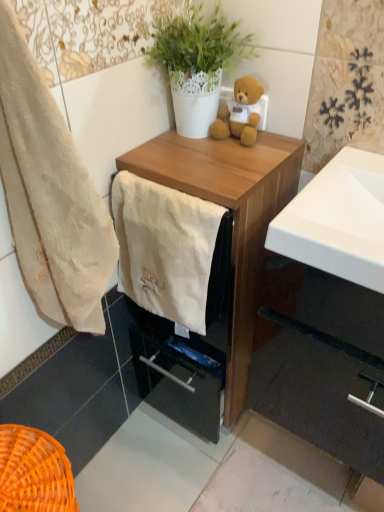
The width and height of the screenshot is (384, 512). Describe the element at coordinates (165, 248) in the screenshot. I see `white soft towel at center, which is the 2th towel/napkin from left to right` at that location.

In order to click on white soft towel at center, the first towel/napkin in the right-to-left sequence in this screenshot , I will do `click(165, 248)`.

You are a GUI agent. You are given a task and a screenshot of the screen. Output one action in this format:
    pyautogui.click(x=<x>, y=<y>)
    Task: Click on the white textured pot at upper center
    This screenshot has width=384, height=512.
    Given the screenshot: What is the action you would take?
    pyautogui.click(x=197, y=63)

Find the location of a particular element. The height and width of the screenshot is (512, 384). soft plush teddy bear at upper center is located at coordinates (240, 113).

What do you see at coordinates (321, 362) in the screenshot? I see `matte wood cabinet at lower right` at bounding box center [321, 362].

The width and height of the screenshot is (384, 512). What are the coordinates of `white glossy sink at center right` in the screenshot? It's located at (338, 220).

This screenshot has height=512, width=384. I want to click on white soft towel at center, which is the 2th towel/napkin from left to right, so click(165, 248).

Which object is further away from the camera, beige cotton towel at left, which appears as the 1th towel/napkin when viewed from the left, or white soft towel at center, the first towel/napkin in the right-to-left sequence?

white soft towel at center, the first towel/napkin in the right-to-left sequence, is further away from the camera.

In terms of size, does beige cotton towel at left, which is counted as the 2th towel/napkin, starting from the right, appear bigger or smaller than white soft towel at center, which is the 2th towel/napkin from left to right?

In the image, beige cotton towel at left, which is counted as the 2th towel/napkin, starting from the right, appears to be larger than white soft towel at center, which is the 2th towel/napkin from left to right.

Image resolution: width=384 pixels, height=512 pixels. What are the coordinates of `towel/napkin below the beige cotton towel at left, which is counted as the 2th towel/napkin, starting from the right (from the image's perspective)` in the screenshot? It's located at (165, 248).

From a real-world perspective, between beige cotton towel at left, which appears as the 1th towel/napkin when viewed from the left, and white soft towel at center, the first towel/napkin in the right-to-left sequence, who is vertically higher?

In real-world perspective, beige cotton towel at left, which appears as the 1th towel/napkin when viewed from the left, is above.

From the image's perspective, is white soft towel at center, the first towel/napkin in the right-to-left sequence, below beige cotton towel at left, which appears as the 1th towel/napkin when viewed from the left?

Yes.

Is white soft towel at center, which is the 2th towel/napkin from left to right, at the right side of beige cotton towel at left, which is counted as the 2th towel/napkin, starting from the right?

Yes.

Would you say white soft towel at center, the first towel/napkin in the right-to-left sequence, is a long distance from beige cotton towel at left, which is counted as the 2th towel/napkin, starting from the right?

They are positioned close to each other.

Does white soft towel at center, which is the 2th towel/napkin from left to right, have a greater width compared to beige cotton towel at left, which appears as the 1th towel/napkin when viewed from the left?

No, white soft towel at center, which is the 2th towel/napkin from left to right, is not wider than beige cotton towel at left, which appears as the 1th towel/napkin when viewed from the left.

Is white soft towel at center, which is the 2th towel/napkin from left to right, to the left of soft plush teddy bear at upper center from the viewer's perspective?

Yes.

From the image's perspective, is white soft towel at center, which is the 2th towel/napkin from left to right, positioned above or below soft plush teddy bear at upper center?

white soft towel at center, which is the 2th towel/napkin from left to right, is below soft plush teddy bear at upper center.

Which is correct: white soft towel at center, which is the 2th towel/napkin from left to right, is inside soft plush teddy bear at upper center, or outside of it?

white soft towel at center, which is the 2th towel/napkin from left to right, is outside soft plush teddy bear at upper center.

Considering the sizes of objects white soft towel at center, the first towel/napkin in the right-to-left sequence, and soft plush teddy bear at upper center in the image provided, who is smaller, white soft towel at center, the first towel/napkin in the right-to-left sequence, or soft plush teddy bear at upper center?

soft plush teddy bear at upper center.

How different are the orientations of matte wood cabinet at lower right and beige cotton towel at left, which appears as the 1th towel/napkin when viewed from the left, in degrees?

The angular difference between matte wood cabinet at lower right and beige cotton towel at left, which appears as the 1th towel/napkin when viewed from the left, is 92.1 degrees.

Looking at this image, does matte wood cabinet at lower right have a lesser width compared to beige cotton towel at left, which appears as the 1th towel/napkin when viewed from the left?

No.

Does matte wood cabinet at lower right have a larger size compared to beige cotton towel at left, which appears as the 1th towel/napkin when viewed from the left?

Yes.

In the image, is wooden chest of drawers at center positioned in front of or behind matte wood cabinet at lower right?

Visually, wooden chest of drawers at center is located in front of matte wood cabinet at lower right.

Is wooden chest of drawers at center oriented away from matte wood cabinet at lower right?

wooden chest of drawers at center does not have its back to matte wood cabinet at lower right.

From the image's perspective, does wooden chest of drawers at center appear higher than matte wood cabinet at lower right?

Indeed, from the image's perspective, wooden chest of drawers at center is shown above matte wood cabinet at lower right.

Does point (232, 179) appear closer or farther from the camera than point (362, 340)?

Point (232, 179) appears to be closer to the viewer than point (362, 340).

In the image, is white glossy sink at center right on the left side or the right side of wooden chest of drawers at center?

Based on their positions, white glossy sink at center right is located to the right of wooden chest of drawers at center.

Identify the location of chest of drawers below the white glossy sink at center right (from the image's perspective). (233, 215).

Is white glossy sink at center right aimed at wooden chest of drawers at center?

No.

From the image's perspective, is wooden chest of drawers at center positioned above or below soft plush teddy bear at upper center?

Based on their image positions, wooden chest of drawers at center is located beneath soft plush teddy bear at upper center.

Could you tell me if wooden chest of drawers at center is turned towards soft plush teddy bear at upper center?

No, wooden chest of drawers at center is not aimed at soft plush teddy bear at upper center.

Between wooden chest of drawers at center and soft plush teddy bear at upper center, which one has smaller size?

With smaller size is soft plush teddy bear at upper center.

At what (x,y) coordinates should I click in order to perform the action: click on towel/napkin above the white soft towel at center, the first towel/napkin in the right-to-left sequence (from the image's perspective). Please return your answer as a coordinate pair (x, y). The width and height of the screenshot is (384, 512). Looking at the image, I should click on (50, 194).

The height and width of the screenshot is (512, 384). Identify the location of towel/napkin located behind the beige cotton towel at left, which appears as the 1th towel/napkin when viewed from the left. (165, 248).

Based on their spatial positions, is beige cotton towel at left, which appears as the 1th towel/napkin when viewed from the left, or white glossy sink at center right closer to soft plush teddy bear at upper center?

white glossy sink at center right lies closer to soft plush teddy bear at upper center than the other object.

Looking at the image, which one is located further to white soft towel at center, which is the 2th towel/napkin from left to right, white textured pot at upper center or wooden chest of drawers at center?

white textured pot at upper center is positioned further to the anchor white soft towel at center, which is the 2th towel/napkin from left to right.

Based on the photo, looking at the image, which one is located further to soft plush teddy bear at upper center, matte wood cabinet at lower right or wooden chest of drawers at center?

matte wood cabinet at lower right is further to soft plush teddy bear at upper center.

Estimate the real-world distances between objects in this image. Which object is closer to beige cotton towel at left, which is counted as the 2th towel/napkin, starting from the right, wooden chest of drawers at center or matte wood cabinet at lower right?

Based on the image, wooden chest of drawers at center appears to be nearer to beige cotton towel at left, which is counted as the 2th towel/napkin, starting from the right.

From the image, which object appears to be nearer to matte wood cabinet at lower right, wooden chest of drawers at center or white textured pot at upper center?

wooden chest of drawers at center is closer to matte wood cabinet at lower right.

Based on their spatial positions, is white glossy sink at center right or wooden chest of drawers at center closer to matte wood cabinet at lower right?

wooden chest of drawers at center is closer to matte wood cabinet at lower right.

From the image, which object appears to be nearer to white glossy sink at center right, soft plush teddy bear at upper center or white soft towel at center, which is the 2th towel/napkin from left to right?

white soft towel at center, which is the 2th towel/napkin from left to right, is positioned closer to the anchor white glossy sink at center right.

Which object lies nearer to the anchor point soft plush teddy bear at upper center, beige cotton towel at left, which appears as the 1th towel/napkin when viewed from the left, or wooden chest of drawers at center?

Among the two, wooden chest of drawers at center is located nearer to soft plush teddy bear at upper center.

Identify the location of teddy bear located between beige cotton towel at left, which appears as the 1th towel/napkin when viewed from the left, and white glossy sink at center right in the left-right direction. The image size is (384, 512). (240, 113).

This screenshot has height=512, width=384. What are the coordinates of `sink that lies between white textured pot at upper center and white soft towel at center, which is the 2th towel/napkin from left to right, from top to bottom` in the screenshot? It's located at (338, 220).

Where is `teddy bear between white textured pot at upper center and white soft towel at center, the first towel/napkin in the right-to-left sequence, in the up-down direction`? This screenshot has height=512, width=384. teddy bear between white textured pot at upper center and white soft towel at center, the first towel/napkin in the right-to-left sequence, in the up-down direction is located at coordinates (240, 113).

Where is `the chest of drawers between white textured pot at upper center and matte wood cabinet at lower right vertically`? The image size is (384, 512). the chest of drawers between white textured pot at upper center and matte wood cabinet at lower right vertically is located at coordinates (233, 215).